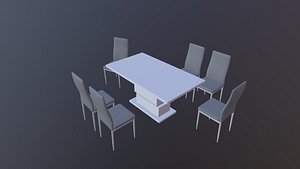
Identify the location of chair leg. (113, 140).